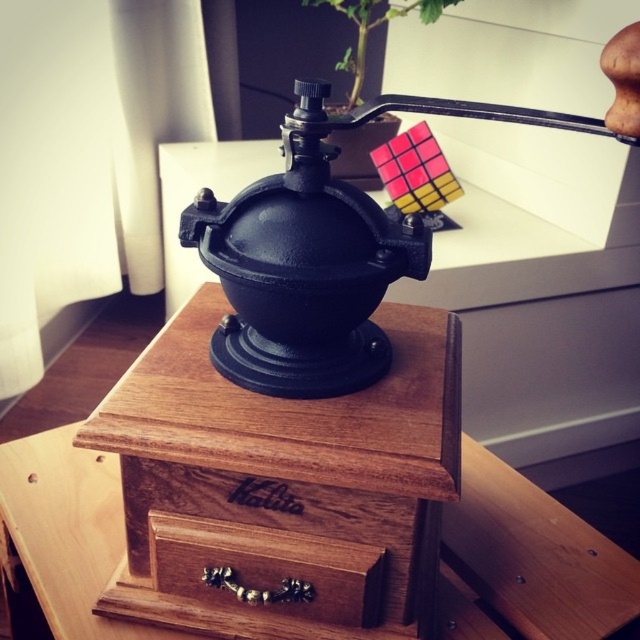
Question: Which of the following is the farthest from the observer?

Choices:
 (A) (452, 1)
 (B) (440, 227)

Answer: (B)

Question: Does brown wood drawer at center appear on the left side of rubberized plastic rubik's cube at upper right?

Choices:
 (A) no
 (B) yes

Answer: (B)

Question: Which object is positioned farthest from the green leafy plant at upper center?

Choices:
 (A) wooden table at center
 (B) black cast iron coffee grinder at center

Answer: (A)

Question: Does wooden table at center appear on the left side of green leafy plant at upper center?

Choices:
 (A) yes
 (B) no

Answer: (B)

Question: Which object is positioned closest to the rubberized plastic rubik's cube at upper right?

Choices:
 (A) black cast iron coffee grinder at center
 (B) wooden table at center
 (C) brown wood drawer at center

Answer: (B)

Question: From the image, what is the correct spatial relationship of wooden table at center in relation to rubberized plastic rubik's cube at upper right?

Choices:
 (A) below
 (B) above

Answer: (A)